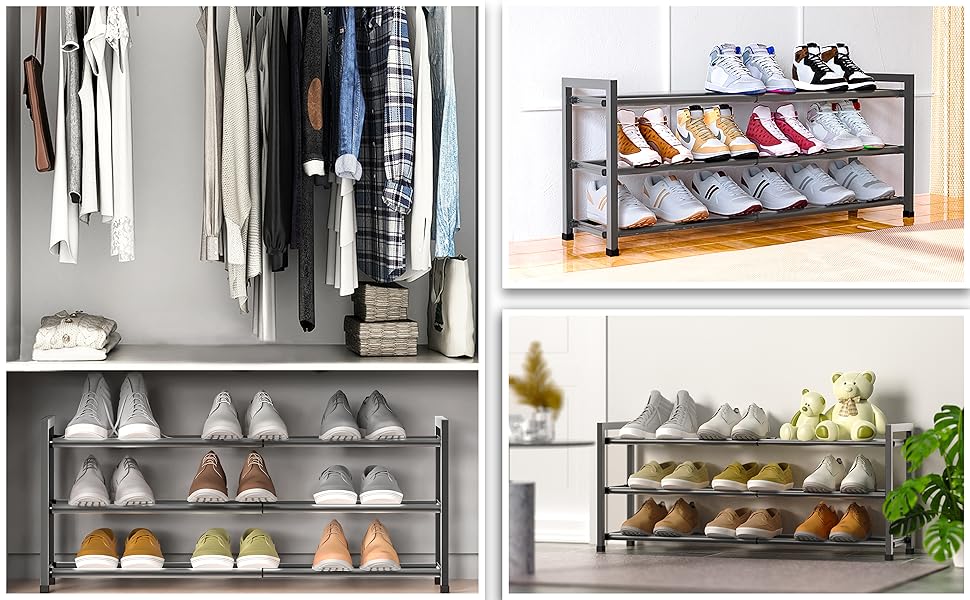
Locate an element on the screen. The image size is (970, 600). total shelves in image is located at coordinates (244, 360), (186, 440), (176, 502), (190, 573), (710, 96), (759, 164), (811, 211), (816, 444), (815, 497), (826, 543).